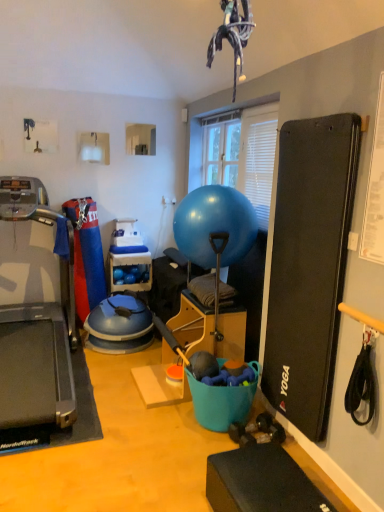
Question: Can you confirm if blue plastic shelf at center is thinner than black rubber treadmill at left?

Choices:
 (A) no
 (B) yes

Answer: (B)

Question: Is the position of blue plastic shelf at center less distant than that of black rubber treadmill at left?

Choices:
 (A) yes
 (B) no

Answer: (B)

Question: Is the position of blue plastic shelf at center more distant than that of black rubber treadmill at left?

Choices:
 (A) no
 (B) yes

Answer: (B)

Question: Does blue plastic shelf at center appear on the left side of black rubber treadmill at left?

Choices:
 (A) yes
 (B) no

Answer: (B)

Question: Does blue plastic shelf at center have a larger size compared to black rubber treadmill at left?

Choices:
 (A) yes
 (B) no

Answer: (B)

Question: Is blue plastic shelf at center positioned with its back to black rubber treadmill at left?

Choices:
 (A) no
 (B) yes

Answer: (A)

Question: Could you tell me if blue plastic shelf at center is facing glossy rubber ball at center?

Choices:
 (A) yes
 (B) no

Answer: (A)

Question: From the image's perspective, does blue plastic shelf at center appear higher than glossy rubber ball at center?

Choices:
 (A) yes
 (B) no

Answer: (B)

Question: From a real-world perspective, is blue plastic shelf at center under glossy rubber ball at center?

Choices:
 (A) yes
 (B) no

Answer: (A)

Question: Is blue plastic shelf at center not close to glossy rubber ball at center?

Choices:
 (A) yes
 (B) no

Answer: (A)

Question: Can you see blue plastic shelf at center touching glossy rubber ball at center?

Choices:
 (A) yes
 (B) no

Answer: (B)

Question: Is blue plastic shelf at center turned away from glossy rubber ball at center?

Choices:
 (A) yes
 (B) no

Answer: (B)

Question: From a real-world perspective, is black rubber treadmill at left beneath glossy rubber ball at center?

Choices:
 (A) yes
 (B) no

Answer: (A)